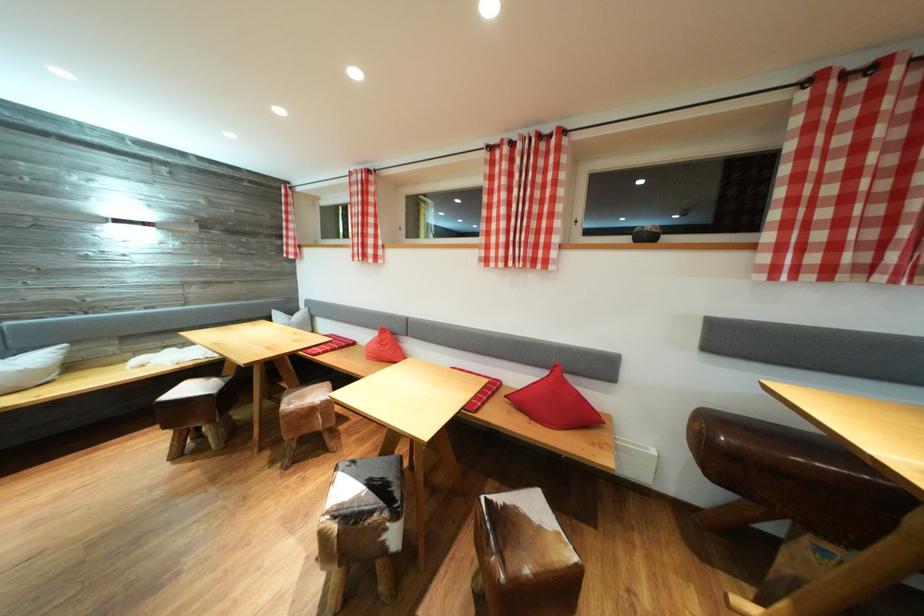
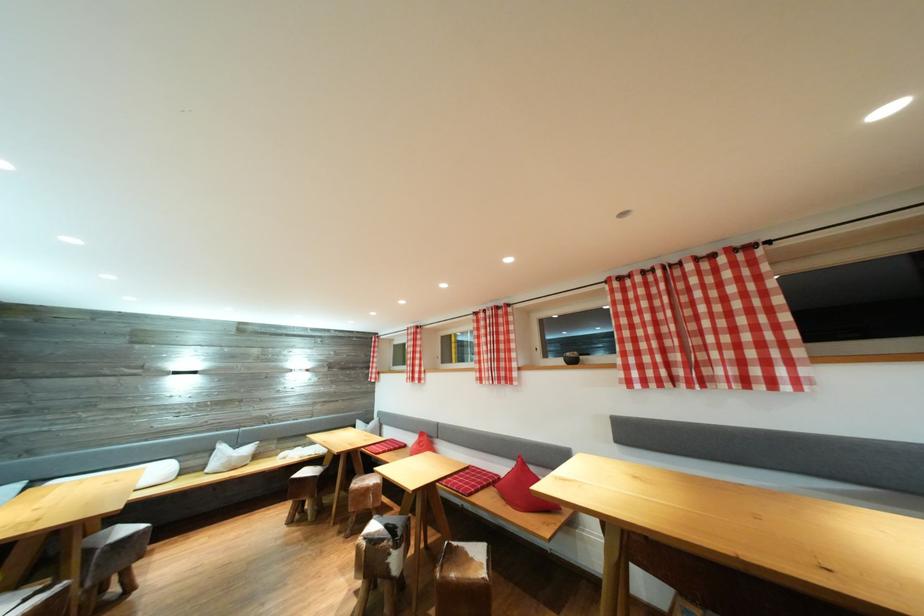
Find the pixel in the second image that matches the point at 319,416 in the first image.

(373, 496)